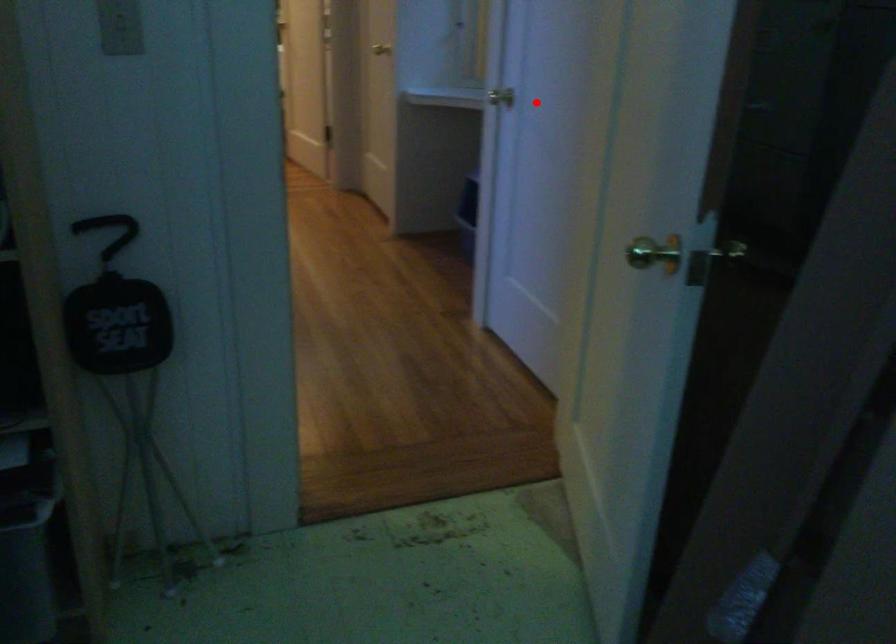
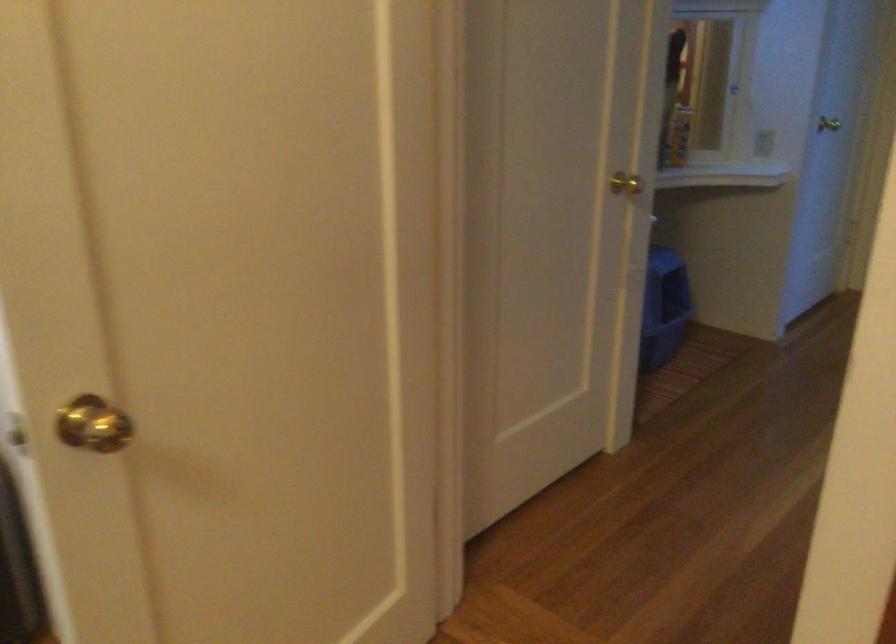
Question: I am providing you with two images of the same scene from different viewpoints. A red point is marked on the first image. At the location where the point appears in image 1, is it still visible in image 2?

Choices:
 (A) Yes
 (B) No

Answer: (A)